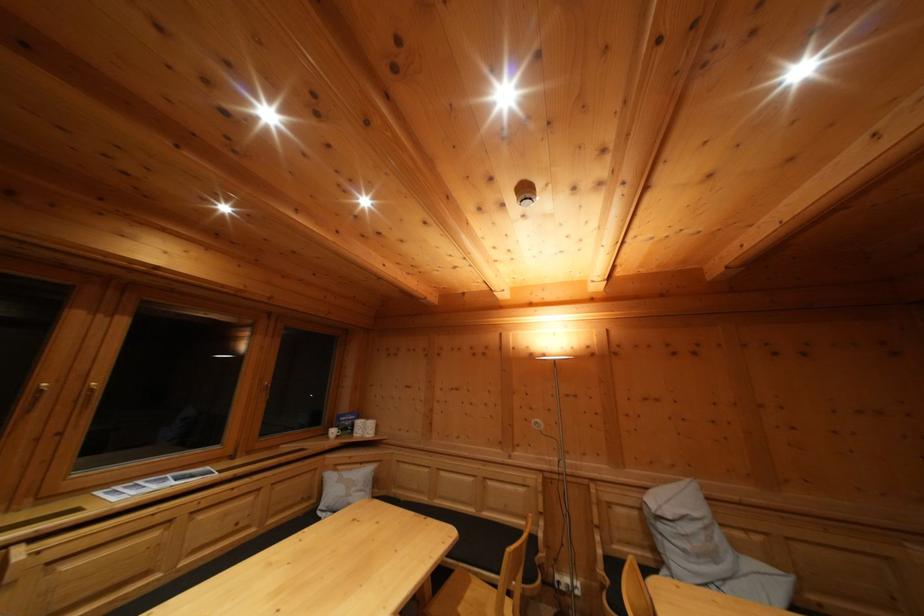
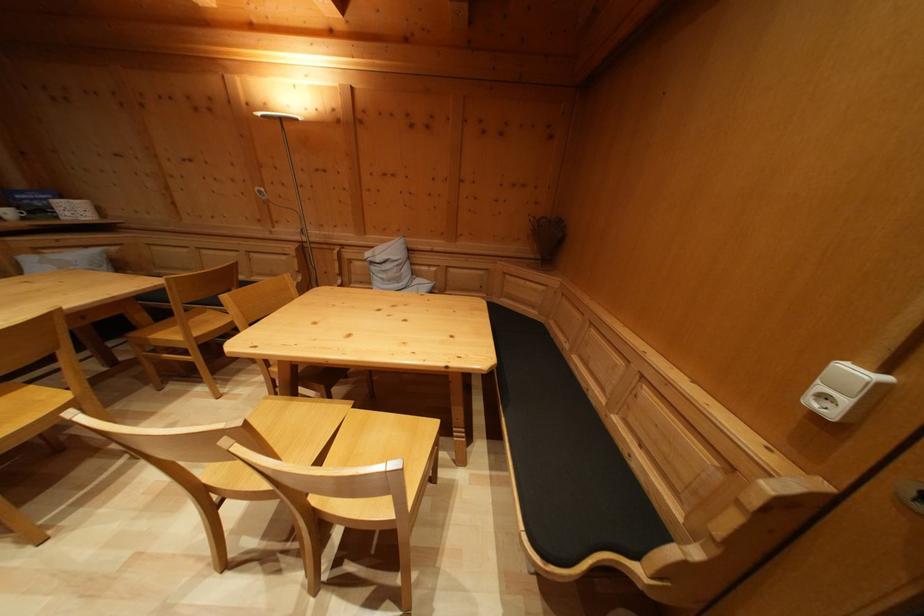
Where in the second image is the point corresponding to point (339, 439) from the first image?

(14, 219)